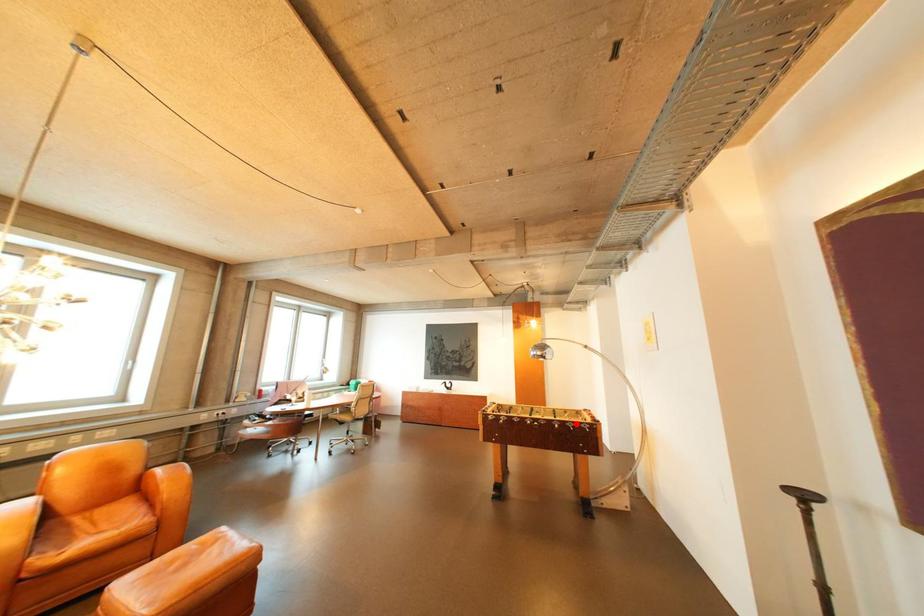
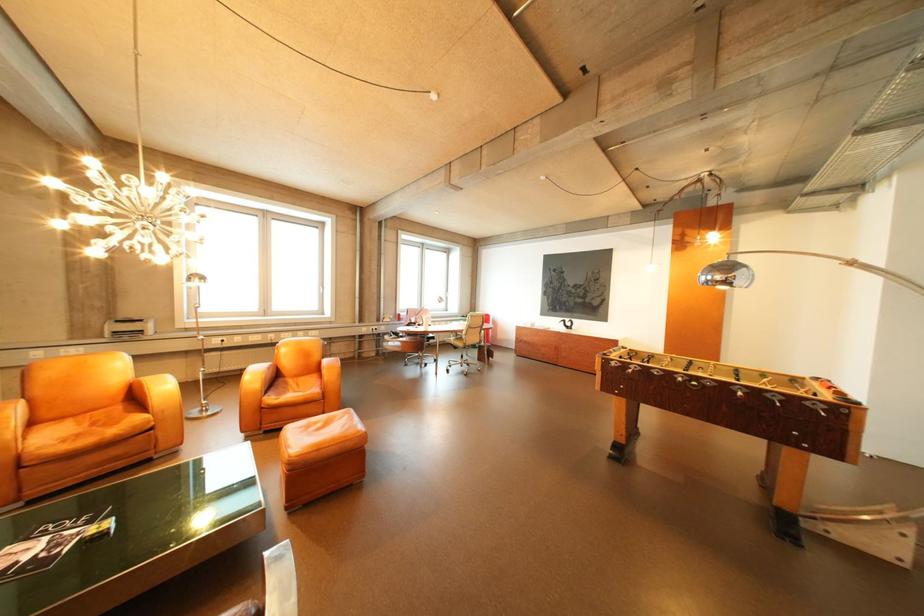
The point at the highlighted location is marked in the first image. Where is the corresponding point in the second image?

(769, 392)